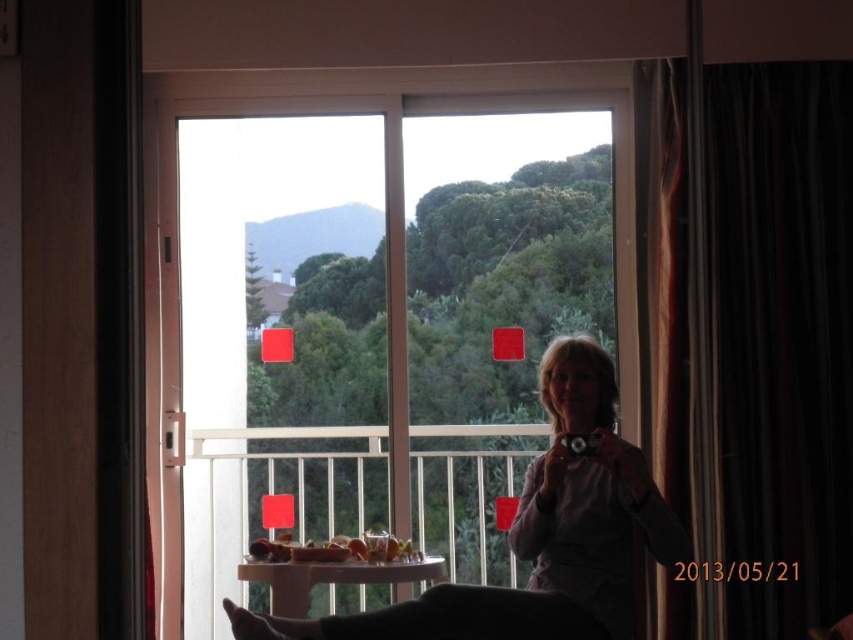
Does matte purple shirt at center have a lesser width compared to green matte mountain at upper left?

No.

How distant is matte purple shirt at center from green matte mountain at upper left?

They are 23.20 inches apart.

The image size is (853, 640). What do you see at coordinates (540, 534) in the screenshot?
I see `matte purple shirt at center` at bounding box center [540, 534].

Where is `matte purple shirt at center`? This screenshot has height=640, width=853. matte purple shirt at center is located at coordinates (540, 534).

Between matte purple shirt at center and white plastic table at center, which one is positioned higher?

white plastic table at center

Who is lower down, matte purple shirt at center or white plastic table at center?

Positioned lower is matte purple shirt at center.

Does point (561, 355) lie in front of point (225, 548)?

No, (561, 355) is further to viewer.

Find the location of a particular element. This screenshot has width=853, height=640. matte purple shirt at center is located at coordinates coord(540,534).

Between transparent glass door at center and green matte mountain at upper left, which one appears on the right side from the viewer's perspective?

transparent glass door at center

Who is taller, transparent glass door at center or green matte mountain at upper left?

transparent glass door at center

Is point (403, 502) positioned before point (380, 225)?

Yes, point (403, 502) is in front of point (380, 225).

Where is `transparent glass door at center`? Image resolution: width=853 pixels, height=640 pixels. transparent glass door at center is located at coordinates (392, 216).